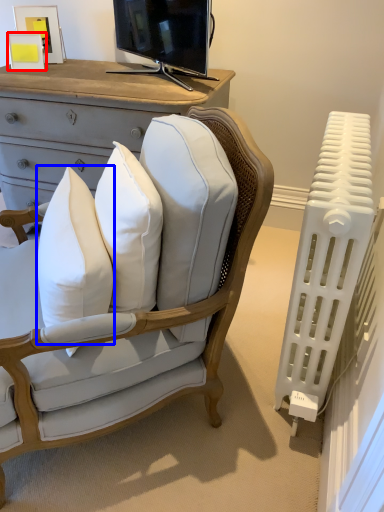
Question: Which object appears farthest to the camera in this image, picture frame (highlighted by a red box) or pillow (highlighted by a blue box)?

Choices:
 (A) picture frame
 (B) pillow

Answer: (A)